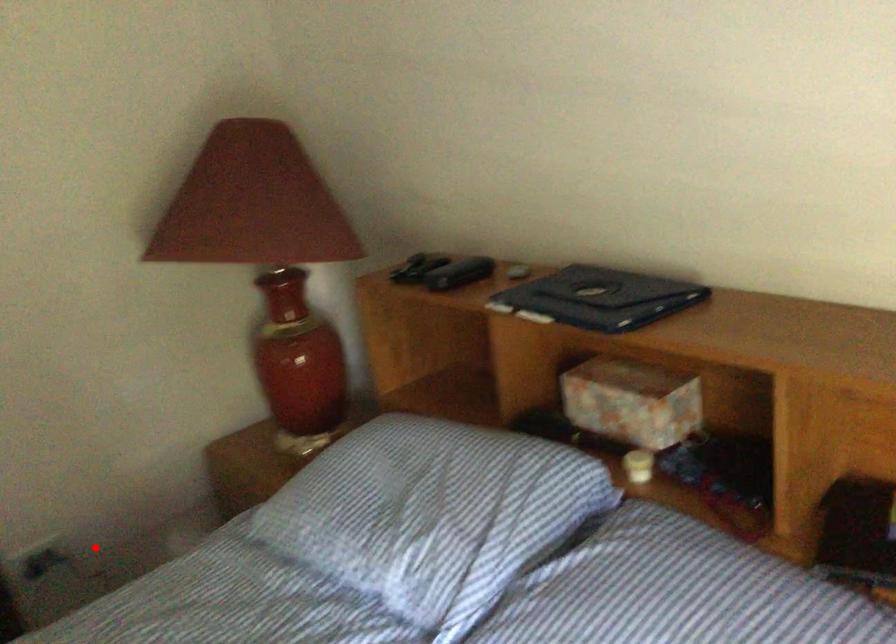
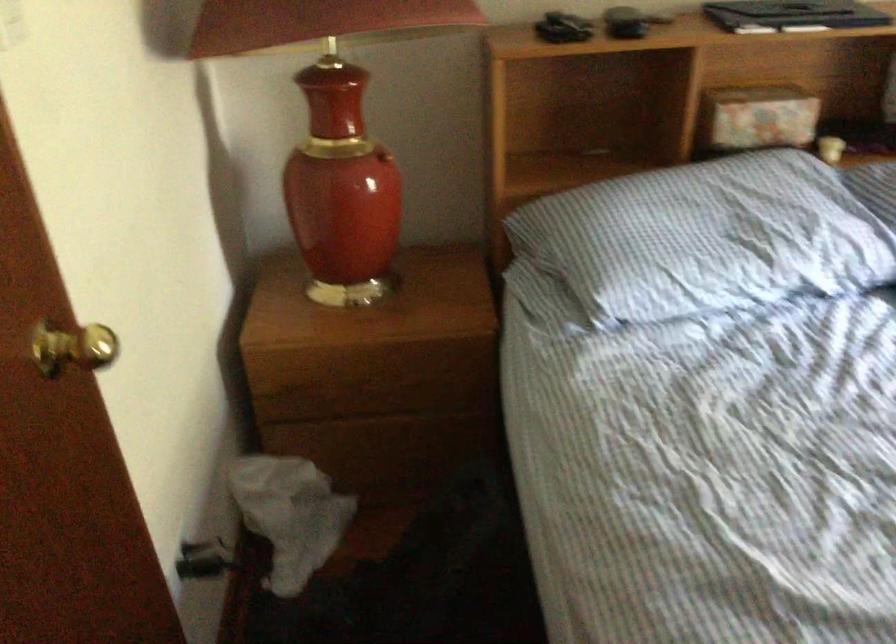
Question: I am providing you with two images of the same scene from different viewpoints. A red point is shown in image1. For the corresponding object point in image2, is it positioned nearer or farther from the camera?

Choices:
 (A) Nearer
 (B) Farther

Answer: (A)